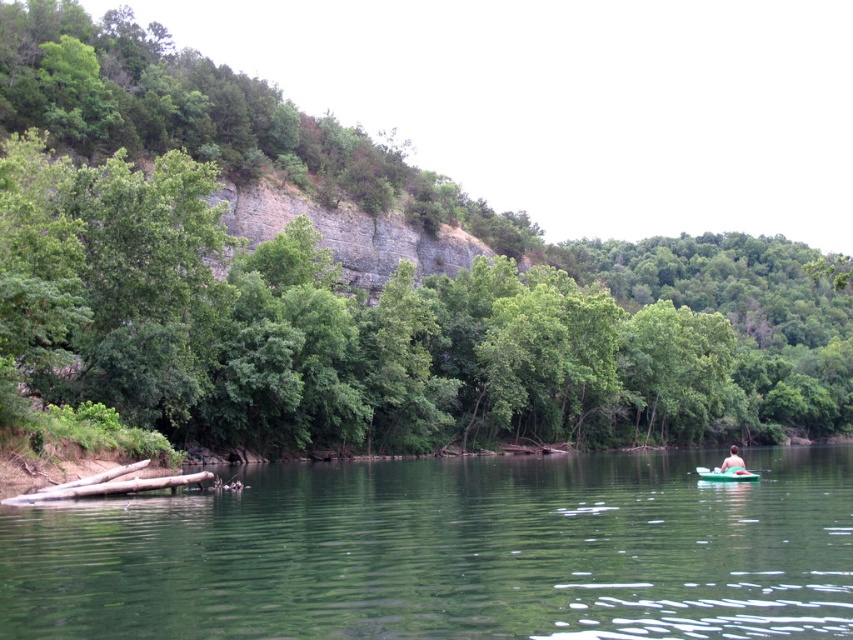
You are taking a photo of the serene natural scene with the kayak and person. You want to focus on the point closer to you. Which point should you focus on, point (747, 474) or point (735, 460)?

Point (735, 460) is closer to you than point (747, 474), so you should focus on point (735, 460).

From the picture: You are a kayaker who just arrived at the lake and want to reach the green plastic canoe at lower right. The green smooth water at center is where you need to pass through. Considering the distance between them, can you estimate how far you need to paddle from your current position to reach the canoe?

The distance between the green smooth water at center and the green plastic canoe at lower right is 57.59 feet. Therefore, you need to paddle approximately 57.59 feet to reach the canoe.